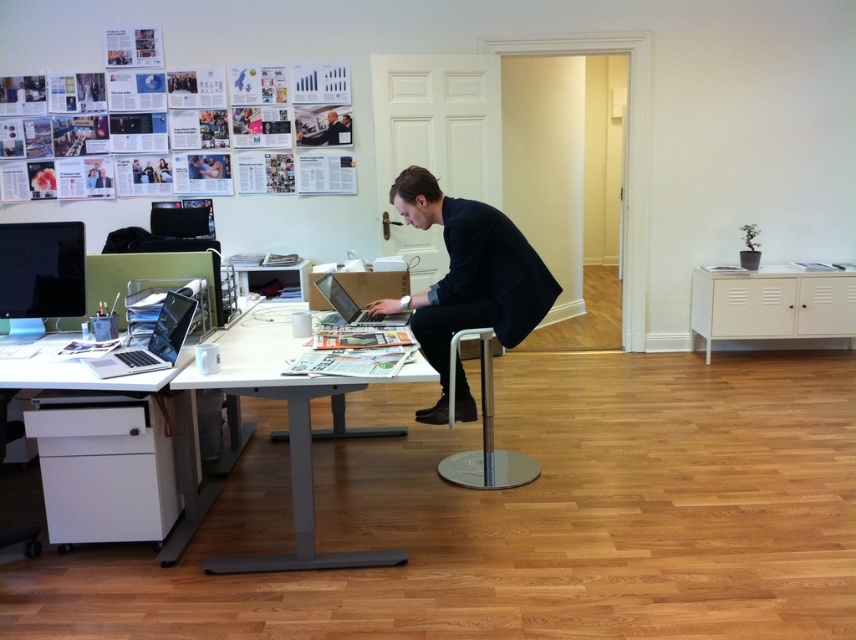
Which is in front, point (723, 280) or point (342, 294)?

Point (342, 294)

Between point (703, 323) and point (337, 292), which one is positioned behind?

Positioned behind is point (703, 323).

Is point (841, 282) farther from viewer compared to point (357, 308)?

Yes.

Identify the location of white matte cabinet at right. The height and width of the screenshot is (640, 856). (771, 305).

Is matte black monitor at left shorter than silver metallic laptop at left?

No, matte black monitor at left is not shorter than silver metallic laptop at left.

Between matte black monitor at left and silver metallic laptop at left, which one is positioned higher?

Positioned higher is matte black monitor at left.

This screenshot has width=856, height=640. What are the coordinates of `matte black monitor at left` in the screenshot? It's located at (40, 273).

Can you confirm if matte black monitor at left is taller than polished chrome stool at center?

Incorrect, matte black monitor at left's height is not larger of polished chrome stool at center's.

Can you confirm if matte black monitor at left is smaller than polished chrome stool at center?

Yes, matte black monitor at left is smaller than polished chrome stool at center.

Who is more forward, (27, 244) or (484, 467)?

Positioned in front is point (27, 244).

The image size is (856, 640). Identify the location of matte black monitor at left. (40, 273).